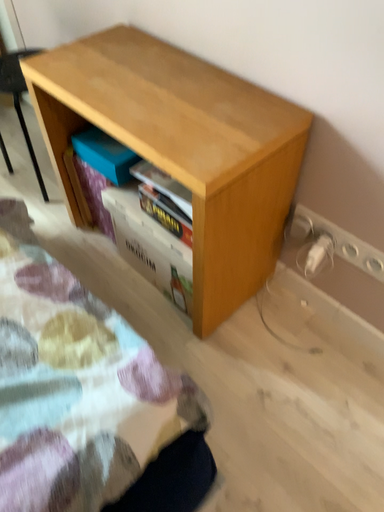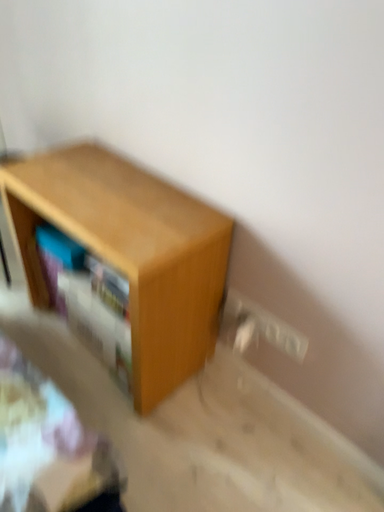
Question: How did the camera likely rotate when shooting the video?

Choices:
 (A) rotated downward
 (B) rotated upward

Answer: (B)